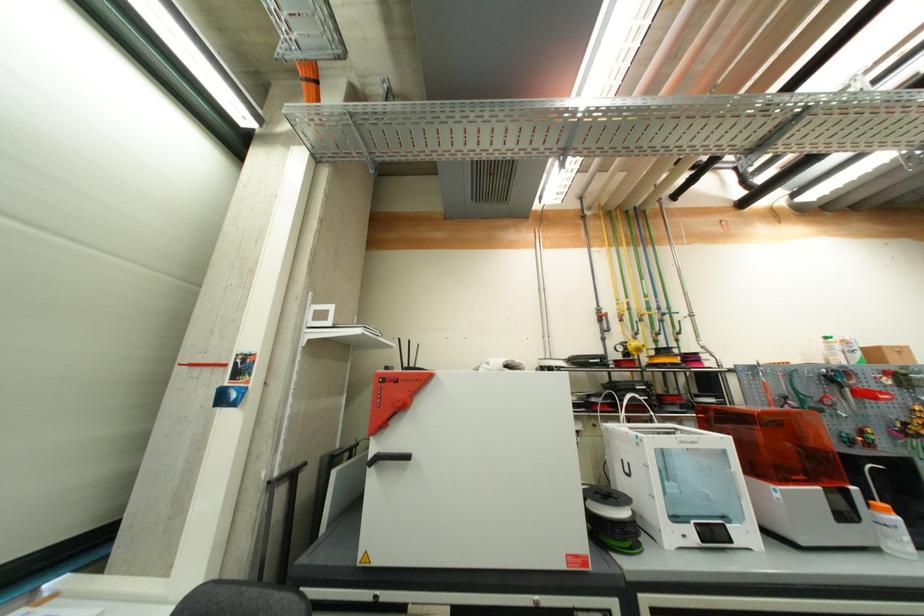
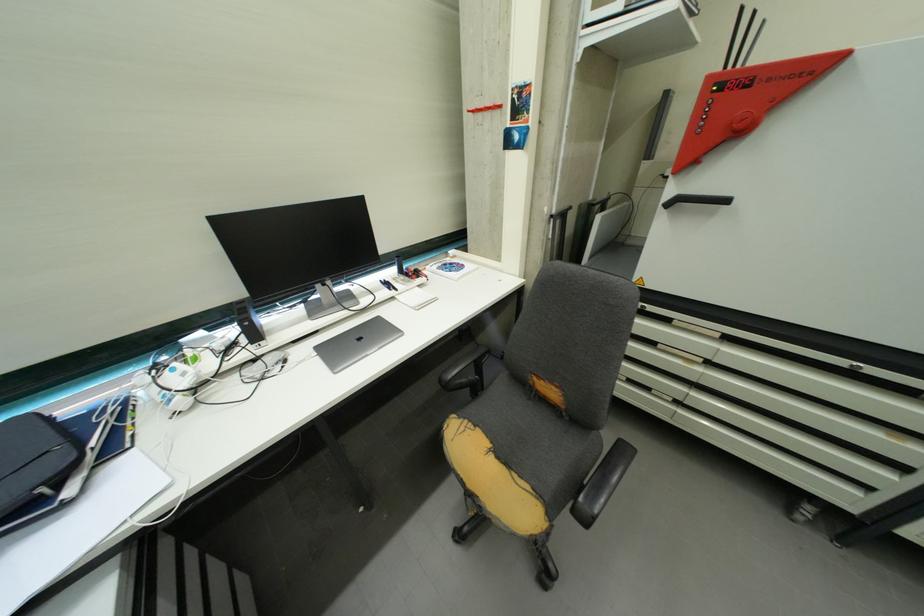
In the second image, find the point that corresponds to point (404, 381) in the first image.

(759, 81)